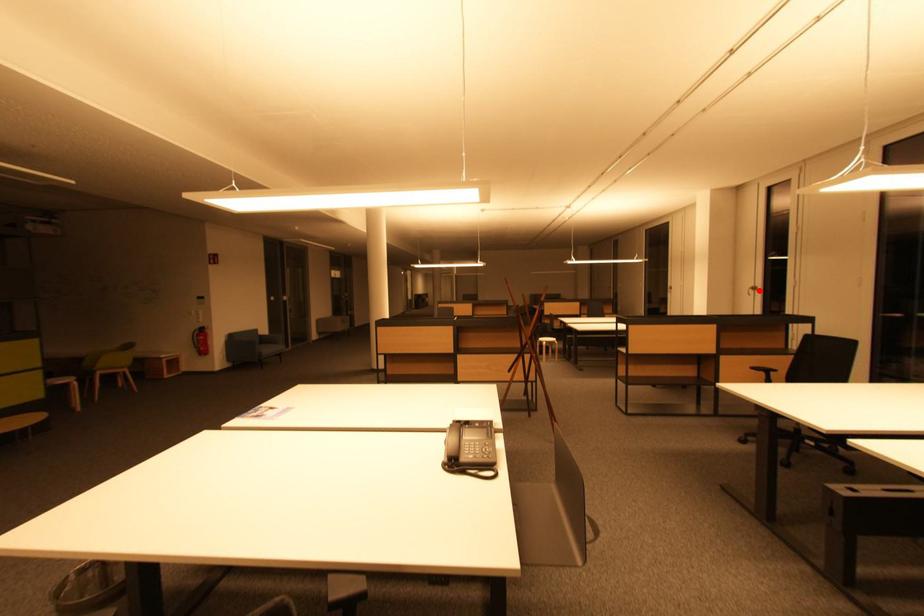
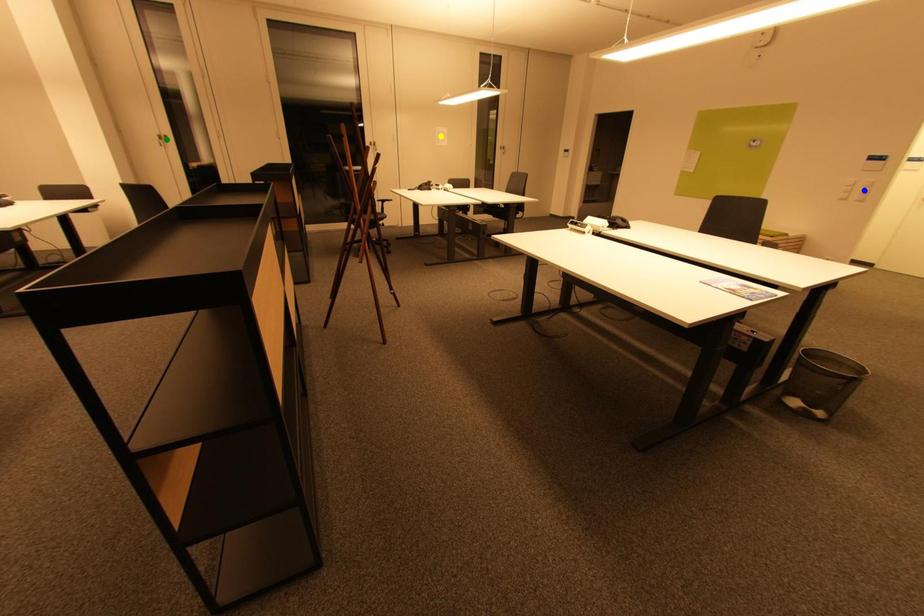
Question: I am providing you with two images of the same scene from different viewpoints. A red point is marked on the first image. You are given multiple points on the second image. Which mark in image 2 goes with the point in image 1?

Choices:
 (A) green point
 (B) yellow point
 (C) blue point

Answer: (A)